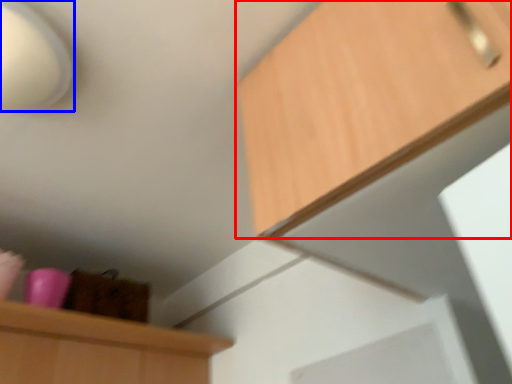
Question: Which of the following is the closest to the observer, cabinetry (highlighted by a red box) or lamp (highlighted by a blue box)?

Choices:
 (A) cabinetry
 (B) lamp

Answer: (A)